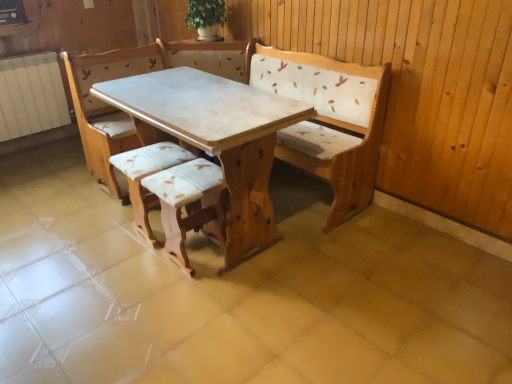
Locate an element on the screen. The height and width of the screenshot is (384, 512). free space in front of matte white cushioned stool at center, which is the first armchair in left-to-right order is located at coordinates (129, 264).